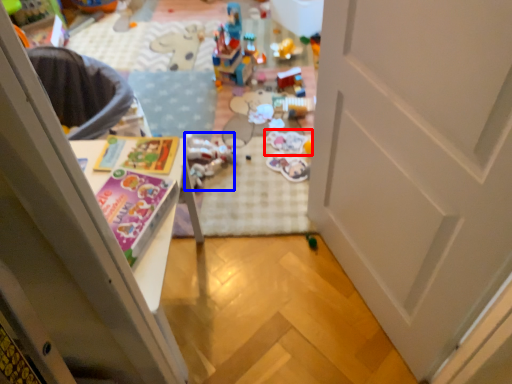
Question: Which point is closer to the camera, toy (highlighted by a red box) or toy (highlighted by a blue box)?

Choices:
 (A) toy
 (B) toy

Answer: (B)